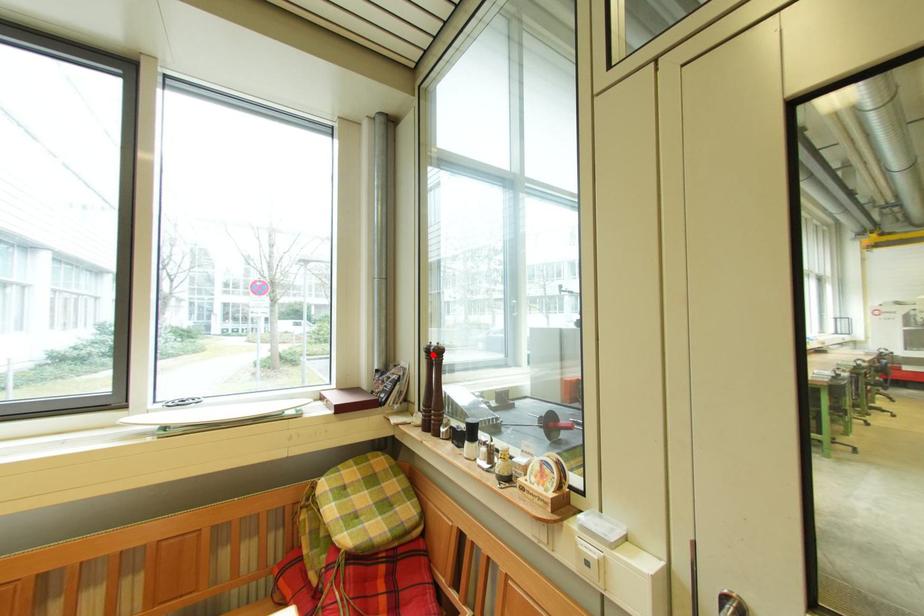
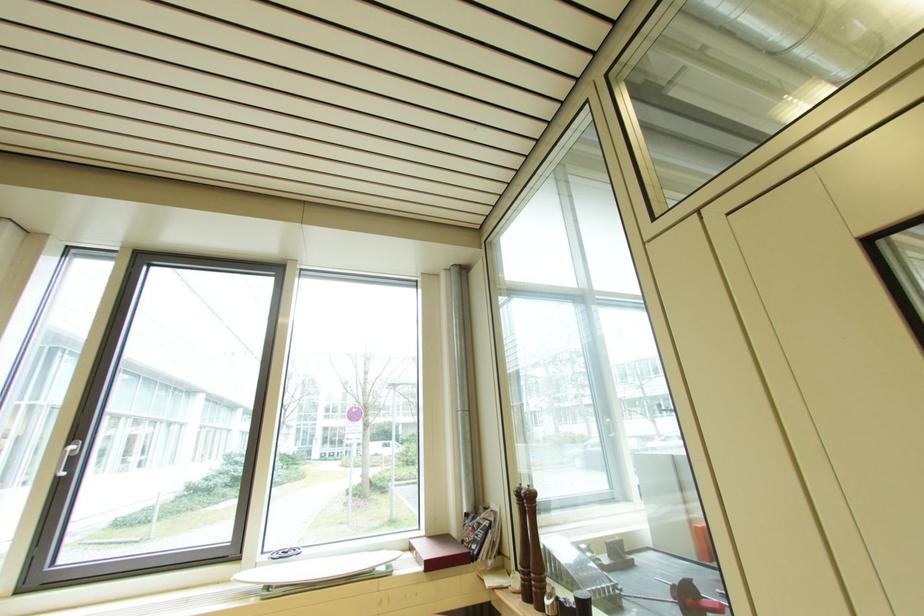
Locate, in the second image, the point that corresponds to the highlighted location in the first image.

(524, 498)